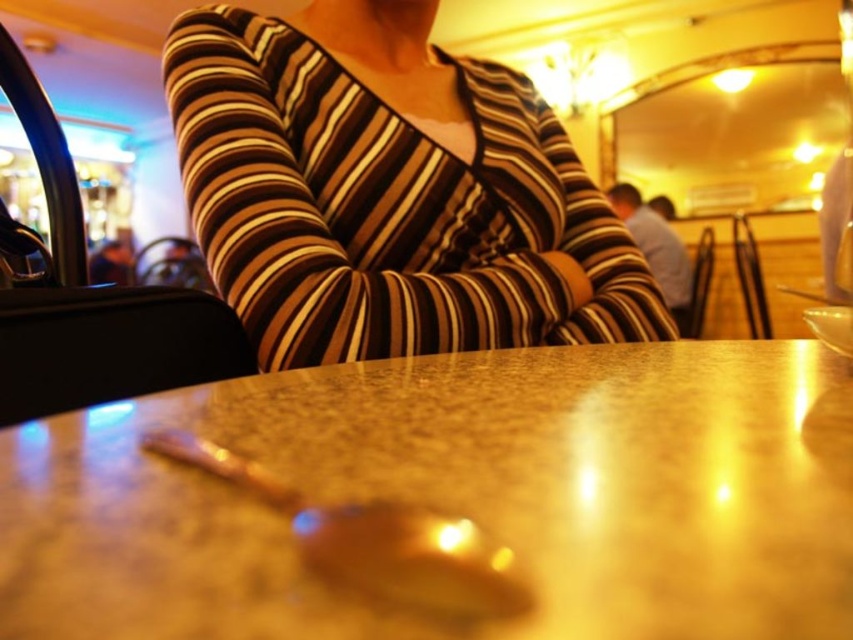
You are a server in this cafe and need to place a 5 inch long dessert plate between the marble table at center and the shiny metallic spoon at center. Is there enough space?

The distance between the marble table at center and the shiny metallic spoon at center is 4.24 inches, which is shorter than the 5 inch dessert plate. Therefore, there isn not enough space to place the dessert plate between them.

You are a customer sitting at the table in the foreground of the cozy cafe. You notice two points marked in the scene. The first point is at coordinates point (364, 17) and the second is at point (428, 612). Which of these two points is closer to you?

Point (364, 17) is closer to you because it is further to the camera than point (428, 612).